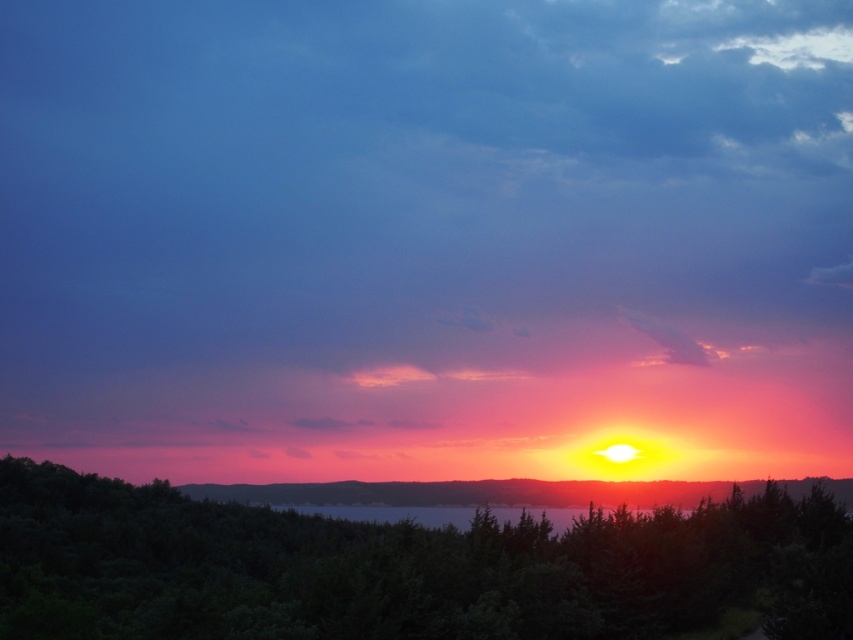
Question: Which object is closer to the camera taking this photo?

Choices:
 (A) translucent glass water at center
 (B) green leafy tree at center
 (C) smooth orange sky at center

Answer: (B)

Question: In this image, where is smooth orange sky at center located relative to translucent glass water at center?

Choices:
 (A) left
 (B) right

Answer: (B)

Question: Estimate the real-world distances between objects in this image. Which object is farther from the translucent glass water at center?

Choices:
 (A) smooth orange sky at center
 (B) green leafy tree at center

Answer: (B)

Question: Does smooth orange sky at center lie in front of translucent glass water at center?

Choices:
 (A) no
 (B) yes

Answer: (A)

Question: Which is nearer to the translucent glass water at center?

Choices:
 (A) green leafy tree at center
 (B) smooth orange sky at center

Answer: (B)

Question: Does green leafy tree at center have a lesser width compared to smooth orange sky at center?

Choices:
 (A) yes
 (B) no

Answer: (A)